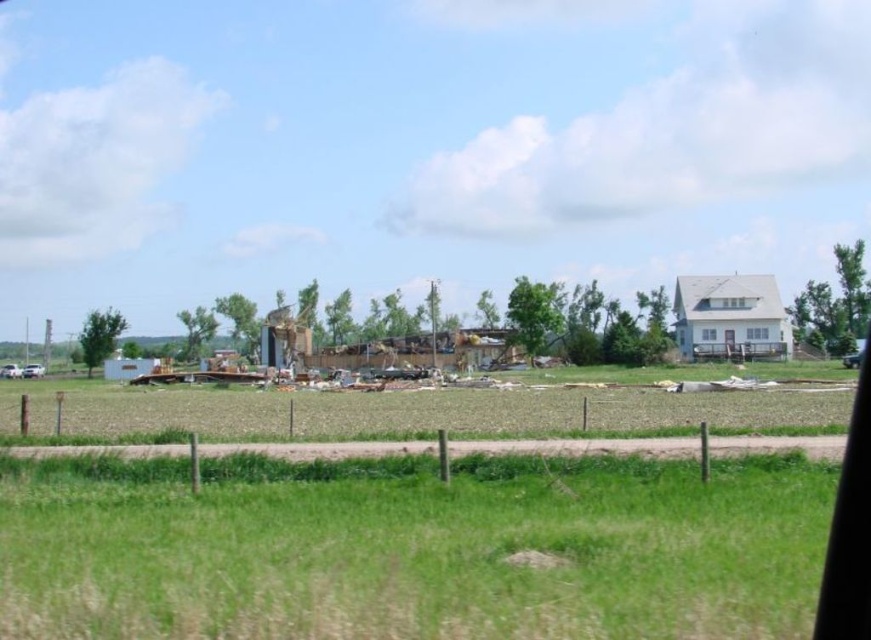
Which of these two, green grass at lower center or brown dirt field at center, stands taller?

brown dirt field at center

I want to click on green grass at lower center, so click(415, 548).

Measure the distance between green grass at lower center and camera.

5.87 meters

Locate an element on the screen. The image size is (871, 640). green grass at lower center is located at coordinates (415, 548).